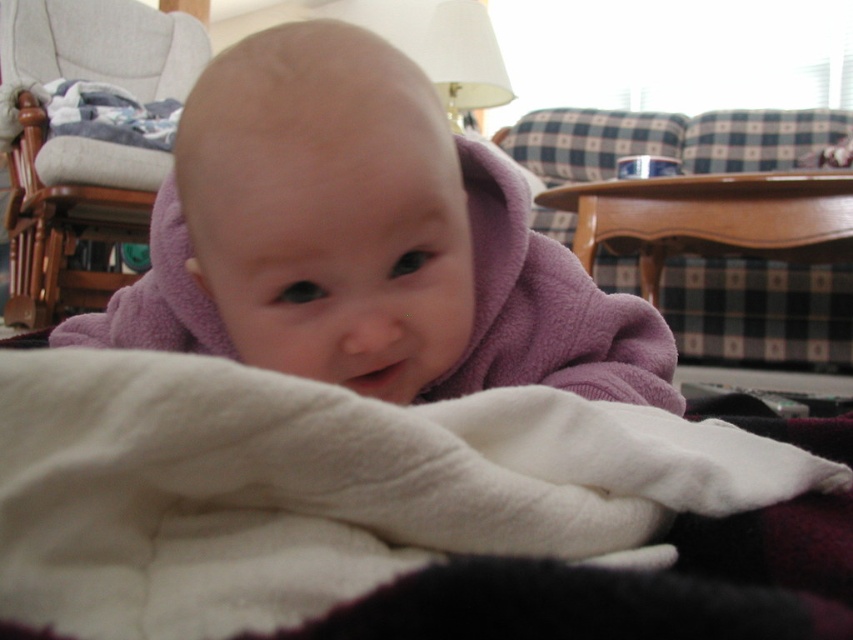
Looking at this image, does white fleece blanket at center appear over gray fabric rocking chair at upper left?

No, white fleece blanket at center is not above gray fabric rocking chair at upper left.

Between point (167, 573) and point (50, 285), which one is positioned in front?

Positioned in front is point (167, 573).

This screenshot has width=853, height=640. I want to click on white fleece blanket at center, so click(x=323, y=488).

Which is more to the left, purple fleece baby at center or gray fabric rocking chair at upper left?

Positioned to the left is gray fabric rocking chair at upper left.

Which of these two, purple fleece baby at center or gray fabric rocking chair at upper left, stands shorter?

With less height is purple fleece baby at center.

Describe the element at coordinates (364, 241) in the screenshot. The width and height of the screenshot is (853, 640). I see `purple fleece baby at center` at that location.

The image size is (853, 640). What are the coordinates of `purple fleece baby at center` in the screenshot? It's located at (364, 241).

How far apart are white fleece blanket at center and purple fleece baby at center?

white fleece blanket at center is 8.27 inches from purple fleece baby at center.

The height and width of the screenshot is (640, 853). I want to click on white fleece blanket at center, so click(323, 488).

Identify the location of white fleece blanket at center. (323, 488).